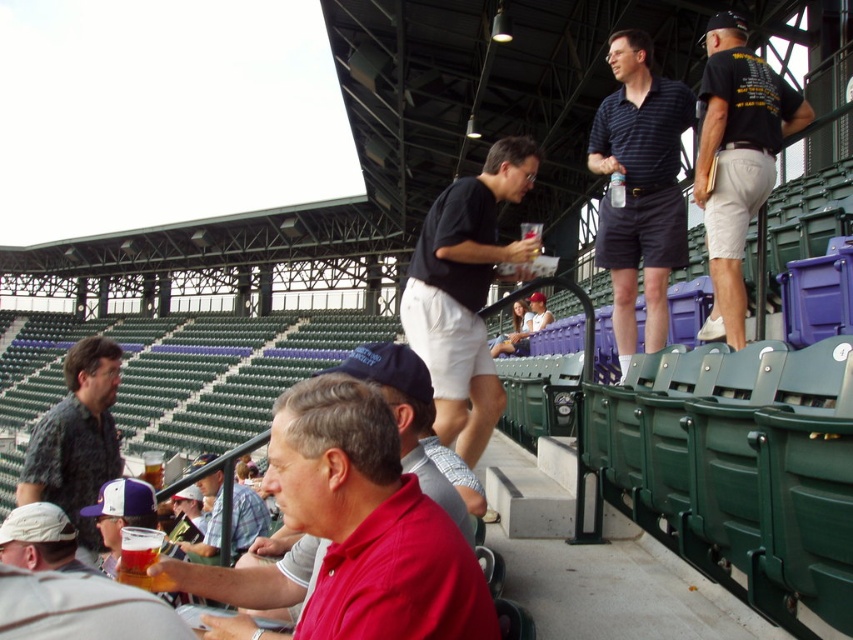
Please describe the exact 2D position of the white fabric cap at lower left in the image using coordinates.

The white fabric cap at lower left is located at coordinates approximately 0.844 on the x axis and 0.048 on the y axis.

You are a spectator at the baseball stadium and want to find a person wearing a black cotton shirt at upper right and a matte black shirt at center. Which one is located to the right side of the other?

The black cotton shirt at upper right is to the right of the matte black shirt at center.

You are at the baseball stadium and want to move from point A to point B. Point A is at coordinates point (485, 332) and point B is at coordinates point (722, 276). Since you are facing north, which direction should you turn to reach point B from point A?

Point (485, 332) is behind point (722, 276), so to reach point B from point A while facing north, you should turn to your right.